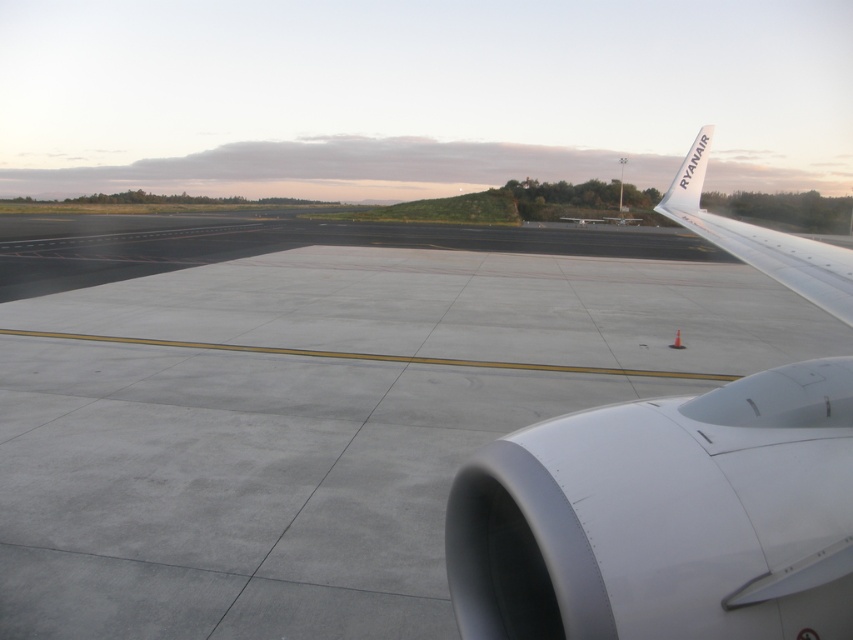
Question: Which of the following is the farthest from the observer?

Choices:
 (A) (780, 605)
 (B) (787, 276)

Answer: (B)

Question: Is white matte airplane wing at upper right to the left of white metallic wing at upper right from the viewer's perspective?

Choices:
 (A) yes
 (B) no

Answer: (A)

Question: Which object is closer to the camera taking this photo?

Choices:
 (A) white matte airplane wing at upper right
 (B) white metallic wing at upper right

Answer: (B)

Question: Does white matte airplane wing at upper right have a smaller size compared to white metallic wing at upper right?

Choices:
 (A) no
 (B) yes

Answer: (B)

Question: In this image, where is white matte airplane wing at upper right located relative to white metallic wing at upper right?

Choices:
 (A) below
 (B) above

Answer: (A)